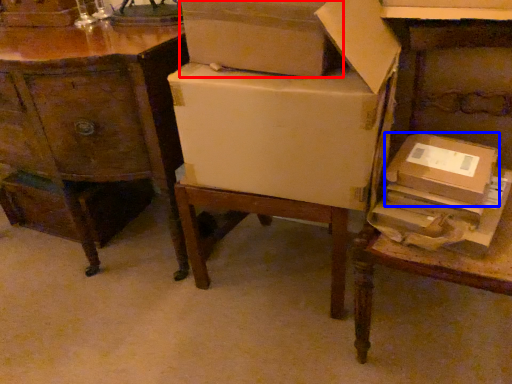
Question: Which of the following is the closest to the observer, box (highlighted by a red box) or cardboard box (highlighted by a blue box)?

Choices:
 (A) box
 (B) cardboard box

Answer: (A)